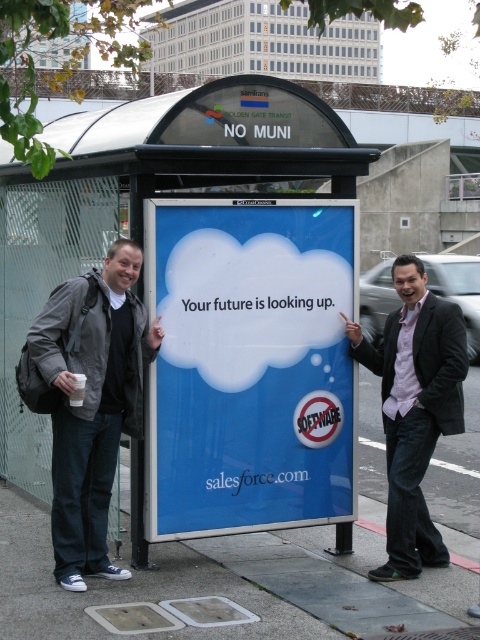
You are a delivery person carrying a box and standing at the bus stop. You need to place your box on the ground between the blue glossy sign at center and the pink shirt at center. Is there enough space to place the box there?

The distance between the blue glossy sign at center and the pink shirt at center is 6.42 feet, so yes, there is enough space to place the box between them.

You are waiting at the NO MUNI bus stop and see a blue glossy sign at center and a pink shirt at center. Which object is closer to you?

The blue glossy sign at center is closer to you because it is further to the viewer than the pink shirt at center.

You are standing at the bus stop and want to locate two points marked on the advertisement board. The first point is at coordinates point (295, 324) and the second is at point (463, 317). From your perspective facing the board, which point is closer to the top edge of the advertisement board?

Point (463, 317) is closer to the top edge of the advertisement board because it has a higher y coordinate than point (295, 324).